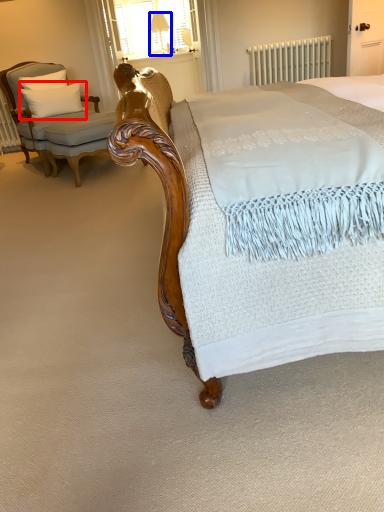
Question: Which object is further to the camera taking this photo, pillow (highlighted by a red box) or table lamp (highlighted by a blue box)?

Choices:
 (A) pillow
 (B) table lamp

Answer: (B)